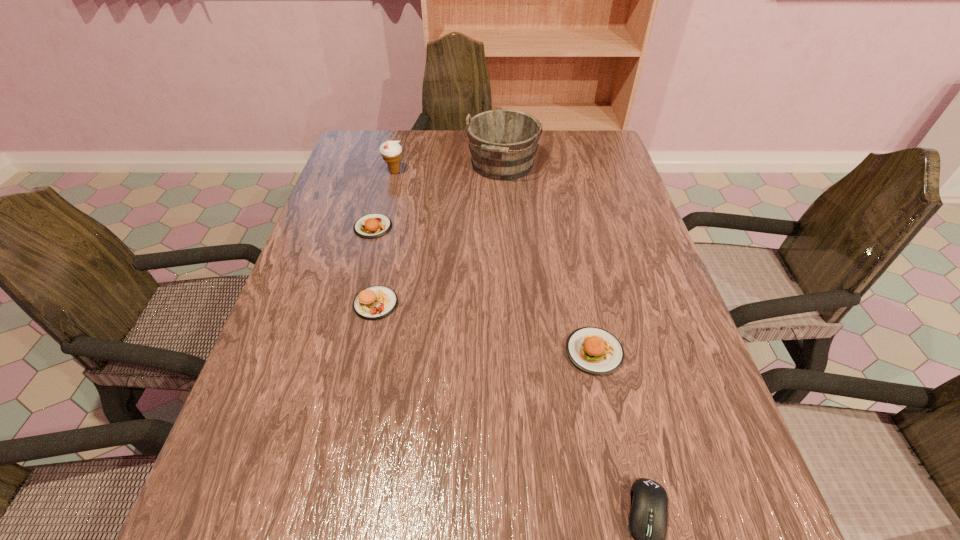
Where is `free point located 0.100m on the front of the second nearest patty (food)`? free point located 0.100m on the front of the second nearest patty (food) is located at coordinates (364, 361).

This screenshot has height=540, width=960. In order to click on free space located on the front of the nearest patty (food) in this screenshot , I will do `click(631, 521)`.

What are the coordinates of `vacant space situated on the front of the third farthest object` in the screenshot? It's located at (348, 324).

Locate an element on the screen. The image size is (960, 540). wine bucket that is at the far edge is located at coordinates (503, 143).

This screenshot has height=540, width=960. Identify the location of icecream that is at the far edge. (391, 151).

I want to click on icecream present at the left edge, so click(x=391, y=151).

You are a GUI agent. You are given a task and a screenshot of the screen. Output one action in this format:
    pyautogui.click(x=<x>, y=<y>)
    Task: Click on the object at the right edge
    
    Given the screenshot: What is the action you would take?
    pyautogui.click(x=594, y=350)

You are a GUI agent. You are given a task and a screenshot of the screen. Output one action in this format:
    pyautogui.click(x=<x>, y=<y>)
    Task: Click on the object that is at the far left corner
    This screenshot has width=960, height=540.
    Given the screenshot: What is the action you would take?
    pyautogui.click(x=391, y=151)

You are a GUI agent. You are given a task and a screenshot of the screen. Output one action in this format:
    pyautogui.click(x=<x>, y=<y>)
    Task: Click on the free space at the far edge
    Image resolution: width=960 pixels, height=540 pixels.
    Given the screenshot: What is the action you would take?
    pyautogui.click(x=454, y=137)

This screenshot has width=960, height=540. I want to click on vacant area at the near edge of the desktop, so click(x=483, y=537).